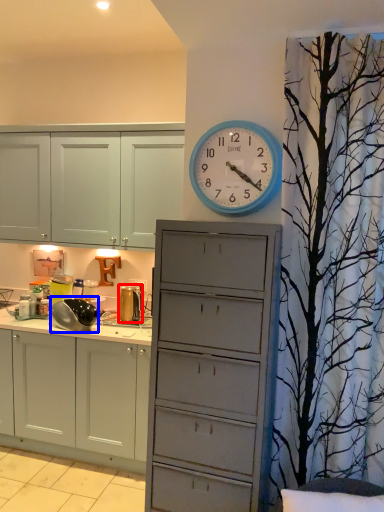
Question: Which point is closer to the camera, appliance (highlighted by a red box) or appliance (highlighted by a blue box)?

Choices:
 (A) appliance
 (B) appliance

Answer: (B)